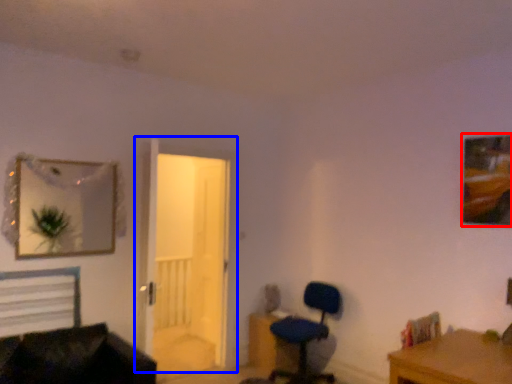
Question: Which object appears closest to the camera in this image, picture frame (highlighted by a red box) or door (highlighted by a blue box)?

Choices:
 (A) picture frame
 (B) door

Answer: (A)